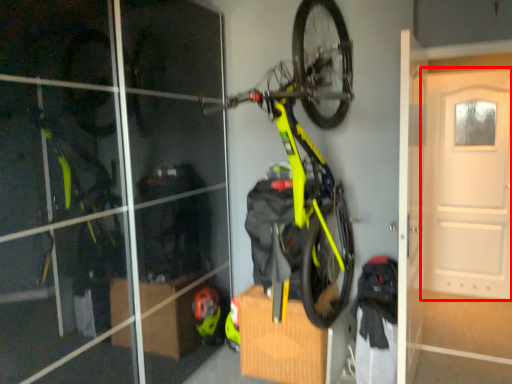
Question: From the image's perspective, considering the relative positions of door (annotated by the red box) and bicycle in the image provided, where is door (annotated by the red box) located with respect to the staircase?

Choices:
 (A) below
 (B) above

Answer: (A)